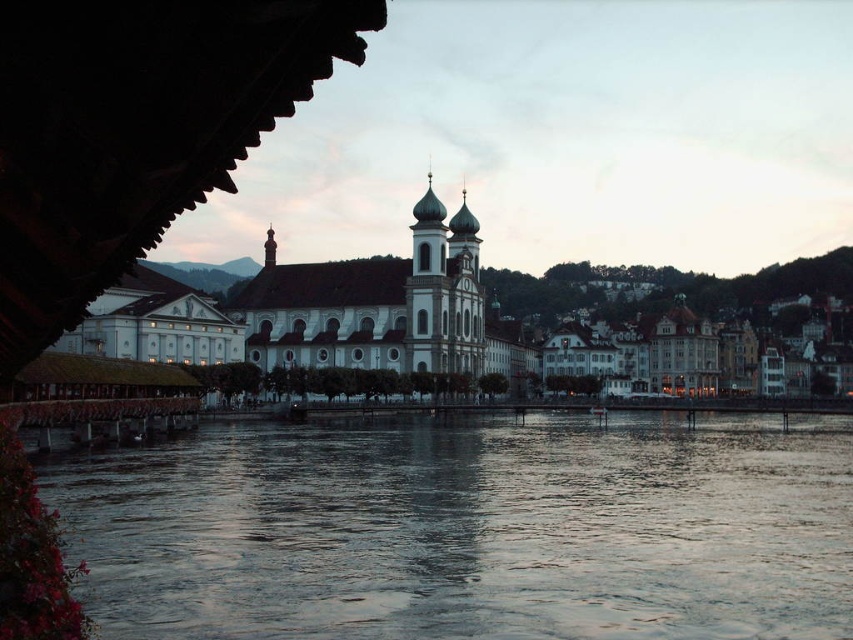
You are standing at the riverside and want to reach the point marked at coordinates point [412,472]. Given that your walking speed is 1.5 meters per second, how long would it take you to reach that point?

The point [412,472] is 91.27 meters away from the viewer. At a walking speed of 1.5 meters per second, it would take approximately 60.85 seconds to reach that point.

You are standing at the riverside and want to take a photo of both point [375,548] and point [91,346] in the same frame. Based on their positions, which point should you focus on first to ensure both are in focus?

You should focus on point [91,346] first because it is further away from you than point [375,548], so focusing on the farther point will keep both in focus.